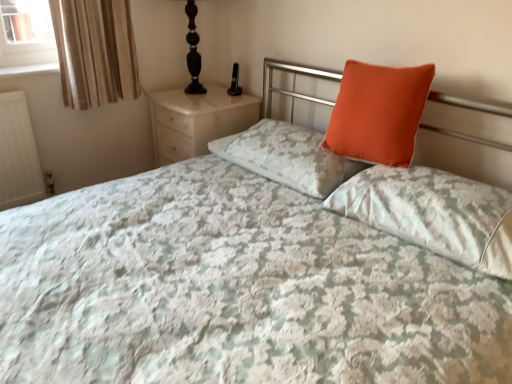
Question: Is orange matte pillow at upper right, which appears as the 2th pillow when viewed from the right, positioned beyond the bounds of beige striped fabric at upper left?

Choices:
 (A) yes
 (B) no

Answer: (A)

Question: Can you confirm if orange matte pillow at upper right, the second pillow in the left-to-right sequence, is positioned to the left of beige striped fabric at upper left?

Choices:
 (A) no
 (B) yes

Answer: (A)

Question: Can you confirm if orange matte pillow at upper right, which appears as the 2th pillow when viewed from the right, is thinner than beige striped fabric at upper left?

Choices:
 (A) yes
 (B) no

Answer: (B)

Question: Is orange matte pillow at upper right, which appears as the 2th pillow when viewed from the right, in contact with beige striped fabric at upper left?

Choices:
 (A) no
 (B) yes

Answer: (A)

Question: Is orange matte pillow at upper right, the second pillow in the left-to-right sequence, aimed at beige striped fabric at upper left?

Choices:
 (A) no
 (B) yes

Answer: (A)

Question: Does point (196, 51) appear closer or farther from the camera than point (106, 74)?

Choices:
 (A) closer
 (B) farther

Answer: (B)

Question: Looking at their shapes, would you say black glass table lamp at upper left is wider or thinner than beige striped fabric at upper left?

Choices:
 (A) thin
 (B) wide

Answer: (B)

Question: Considering the positions of black glass table lamp at upper left and beige striped fabric at upper left in the image, is black glass table lamp at upper left taller or shorter than beige striped fabric at upper left?

Choices:
 (A) tall
 (B) short

Answer: (B)

Question: From a real-world perspective, is black glass table lamp at upper left positioned above or below beige striped fabric at upper left?

Choices:
 (A) below
 (B) above

Answer: (B)

Question: In terms of width, does orange matte pillow at upper right, the second pillow in the left-to-right sequence, look wider or thinner when compared to white marble nightstand at upper left?

Choices:
 (A) wide
 (B) thin

Answer: (B)

Question: Is point (362, 97) closer or farther from the camera than point (178, 115)?

Choices:
 (A) closer
 (B) farther

Answer: (A)

Question: Is orange matte pillow at upper right, the second pillow in the left-to-right sequence, in front of or behind white marble nightstand at upper left in the image?

Choices:
 (A) behind
 (B) front

Answer: (B)

Question: Considering the positions of orange matte pillow at upper right, the second pillow in the left-to-right sequence, and white marble nightstand at upper left in the image, is orange matte pillow at upper right, the second pillow in the left-to-right sequence, taller or shorter than white marble nightstand at upper left?

Choices:
 (A) short
 (B) tall

Answer: (A)

Question: From the image's perspective, is orange fabric pillow at center, which is the 3th pillow from right to left, located above or below black glass table lamp at upper left?

Choices:
 (A) below
 (B) above

Answer: (A)

Question: Is orange fabric pillow at center, which is counted as the first pillow, starting from the left, spatially inside black glass table lamp at upper left, or outside of it?

Choices:
 (A) inside
 (B) outside

Answer: (B)